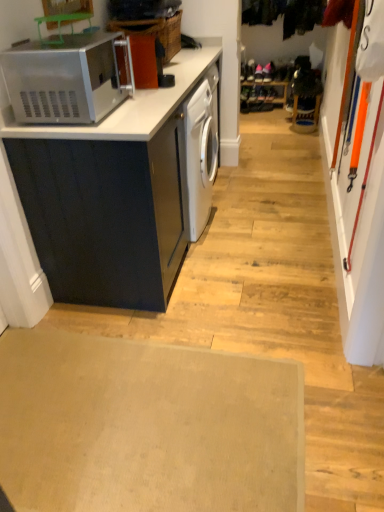
Question: Is beige carpet at lower center beside satin silver microwave at upper left?

Choices:
 (A) no
 (B) yes

Answer: (A)

Question: Does beige carpet at lower center have a greater height compared to satin silver microwave at upper left?

Choices:
 (A) no
 (B) yes

Answer: (A)

Question: Is the position of beige carpet at lower center more distant than that of satin silver microwave at upper left?

Choices:
 (A) no
 (B) yes

Answer: (A)

Question: Does beige carpet at lower center come in front of satin silver microwave at upper left?

Choices:
 (A) no
 (B) yes

Answer: (B)

Question: Considering the relative sizes of beige carpet at lower center and satin silver microwave at upper left in the image provided, is beige carpet at lower center bigger than satin silver microwave at upper left?

Choices:
 (A) no
 (B) yes

Answer: (A)

Question: From a real-world perspective, is satin silver microwave at upper left positioned above or below beige carpet at lower center?

Choices:
 (A) below
 (B) above

Answer: (B)

Question: Considering their positions, is satin silver microwave at upper left located in front of or behind beige carpet at lower center?

Choices:
 (A) behind
 (B) front

Answer: (A)

Question: Is satin silver microwave at upper left situated inside beige carpet at lower center or outside?

Choices:
 (A) inside
 (B) outside

Answer: (B)

Question: Considering the positions of satin silver microwave at upper left and beige carpet at lower center in the image, is satin silver microwave at upper left wider or thinner than beige carpet at lower center?

Choices:
 (A) wide
 (B) thin

Answer: (B)

Question: Looking at the image, does satin silver microwave at upper left seem bigger or smaller compared to matte black cabinet at left?

Choices:
 (A) big
 (B) small

Answer: (B)

Question: Is point (117, 61) positioned closer to the camera than point (67, 192)?

Choices:
 (A) closer
 (B) farther

Answer: (B)

Question: Looking at their shapes, would you say satin silver microwave at upper left is wider or thinner than matte black cabinet at left?

Choices:
 (A) wide
 (B) thin

Answer: (B)

Question: Which is correct: satin silver microwave at upper left is inside matte black cabinet at left, or outside of it?

Choices:
 (A) outside
 (B) inside

Answer: (A)

Question: From the image's perspective, is beige carpet at lower center positioned above or below matte black cabinet at left?

Choices:
 (A) above
 (B) below

Answer: (B)

Question: Considering the positions of point (195, 508) and point (165, 181), is point (195, 508) closer or farther from the camera than point (165, 181)?

Choices:
 (A) closer
 (B) farther

Answer: (A)